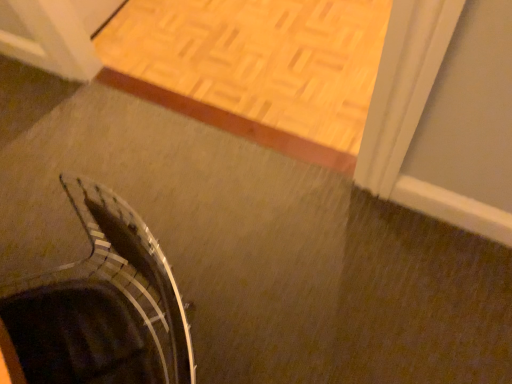
This screenshot has width=512, height=384. What are the coordinates of `shiny black tire at lower left` in the screenshot? It's located at (101, 305).

Describe the element at coordinates (101, 305) in the screenshot. I see `shiny black tire at lower left` at that location.

What are the coordinates of `shiny black tire at lower left` in the screenshot? It's located at [101, 305].